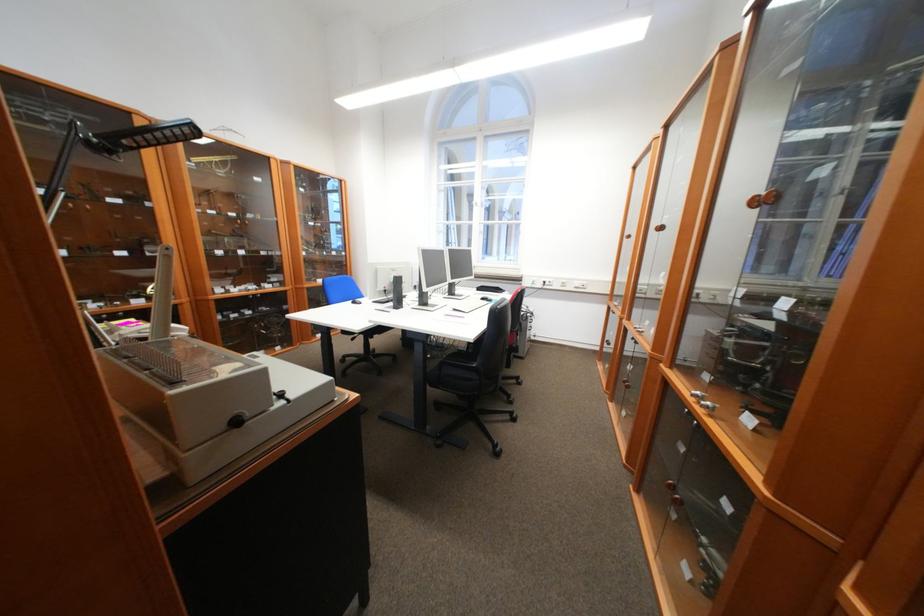
This screenshot has width=924, height=616. What are the coordinates of `blue chair sitting surface` in the screenshot? It's located at (341, 288).